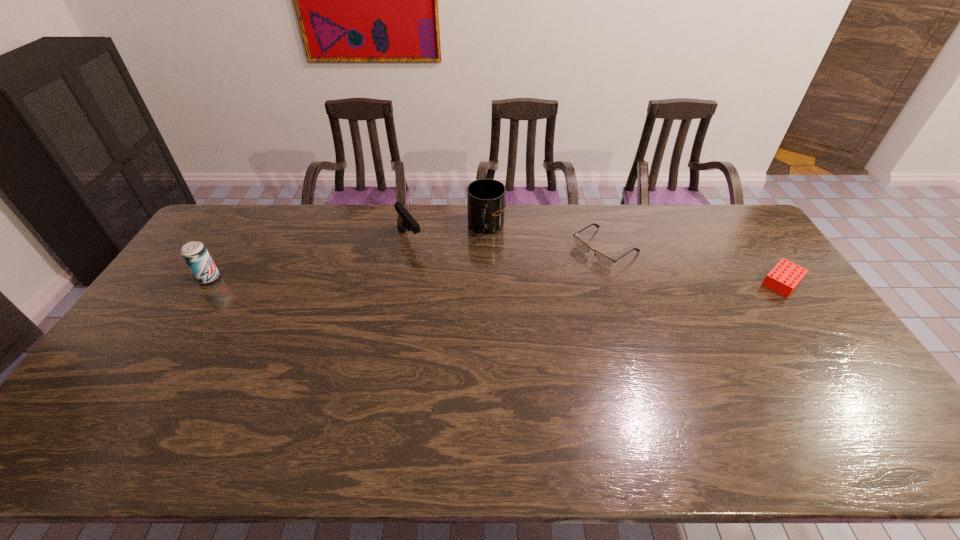
The height and width of the screenshot is (540, 960). Identify the location of vacant point that satisfies the following two spatial constraints: 1. on the front side of the pistol; 2. on the left side of the rightmost object. (402, 282).

Where is `free location that satisfies the following two spatial constraints: 1. on the front side of the mug; 2. on the left side of the Lego`? free location that satisfies the following two spatial constraints: 1. on the front side of the mug; 2. on the left side of the Lego is located at coordinates (488, 282).

Where is `free space in the image that satisfies the following two spatial constraints: 1. on the front side of the rightmost object; 2. on the right side of the third tallest object`? The height and width of the screenshot is (540, 960). free space in the image that satisfies the following two spatial constraints: 1. on the front side of the rightmost object; 2. on the right side of the third tallest object is located at coordinates (402, 282).